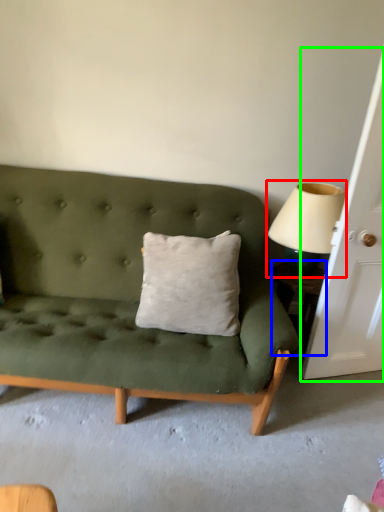
Question: Which object is positioned closest to table lamp (highlighted by a red box)? Select from table (highlighted by a blue box) and door (highlighted by a green box).

Choices:
 (A) table
 (B) door

Answer: (B)